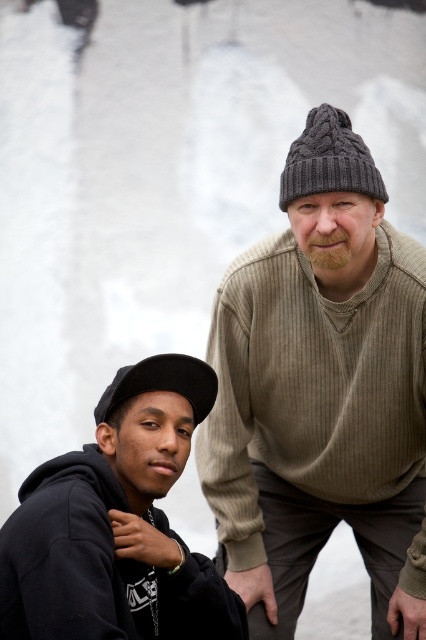
You are a photographer setting up a camera at eye level with the two people in the image. You want to ensure that both the black matte hoodie at lower left and the black fabric cap at lower left are fully visible in the frame. Based on their positions, which object should you adjust your focus to capture first?

The black matte hoodie at lower left is taller than the black fabric cap at lower left, so you should focus on capturing the black matte hoodie at lower left first to ensure it is fully visible in the frame.

You are a photographer trying to capture both the knitted gray beanie at upper right and the dark gray knitted beanie at upper right in a single frame. Given their sizes, which beanie will appear bigger in the photo?

The knitted gray beanie at upper right will appear bigger in the photo because it has a larger size compared to the dark gray knitted beanie at upper right.

You are a photographer setting up a shoot and need to ensure that both the black matte hoodie at lower left and the black fabric cap at lower left are visible in the frame. Based on their positions, which object should you focus on first to ensure both are in the shot?

The black matte hoodie at lower left is located below the black fabric cap at lower left. To ensure both are visible, focus on the black fabric cap at lower left first since it is higher up, allowing the camera to capture both objects in the frame.